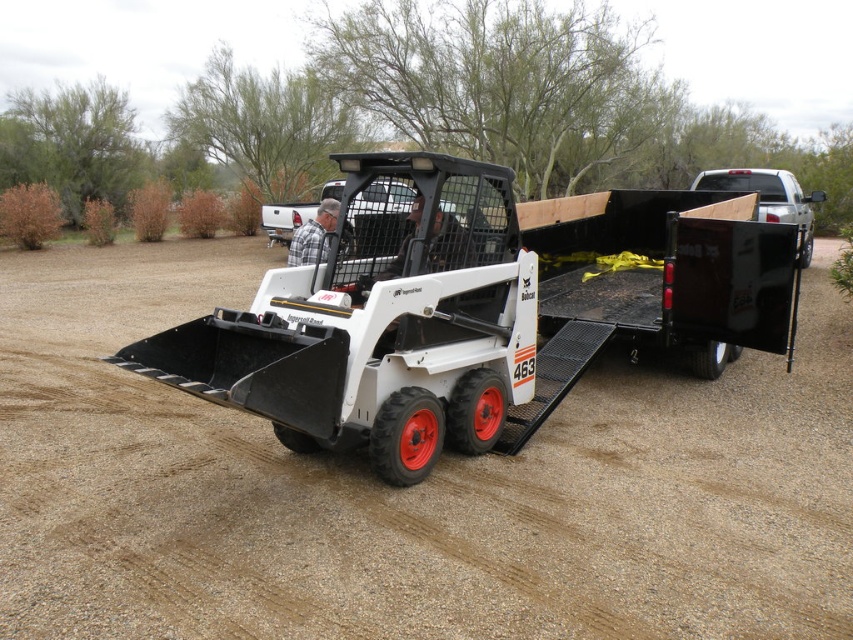
Is point (730, 188) farther from camera compared to point (335, 200)?

That is True.

Between wooden board at right and plaid fabric shirt at center, which one appears on the left side from the viewer's perspective?

From the viewer's perspective, plaid fabric shirt at center appears more on the left side.

What do you see at coordinates (769, 196) in the screenshot? This screenshot has width=853, height=640. I see `wooden board at right` at bounding box center [769, 196].

The height and width of the screenshot is (640, 853). I want to click on wooden board at right, so click(x=769, y=196).

Does dirt track at center have a lesser height compared to black metal trailer truck at center?

No, dirt track at center is not shorter than black metal trailer truck at center.

Is dirt track at center to the left of black metal trailer truck at center from the viewer's perspective?

Incorrect, dirt track at center is not on the left side of black metal trailer truck at center.

Find the location of `dirt track at center`. dirt track at center is located at coordinates (405, 490).

Which is behind, point (337, 374) or point (775, 216)?

Positioned behind is point (775, 216).

The image size is (853, 640). What do you see at coordinates (479, 310) in the screenshot? I see `black metal trailer truck at center` at bounding box center [479, 310].

Find the location of `black metal trailer truck at center`. black metal trailer truck at center is located at coordinates (479, 310).